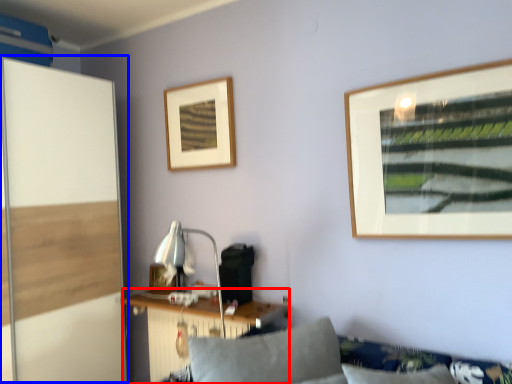
Question: Among these objects, which one is nearest to the camera, table (highlighted by a red box) or screen door (highlighted by a blue box)?

Choices:
 (A) table
 (B) screen door

Answer: (B)